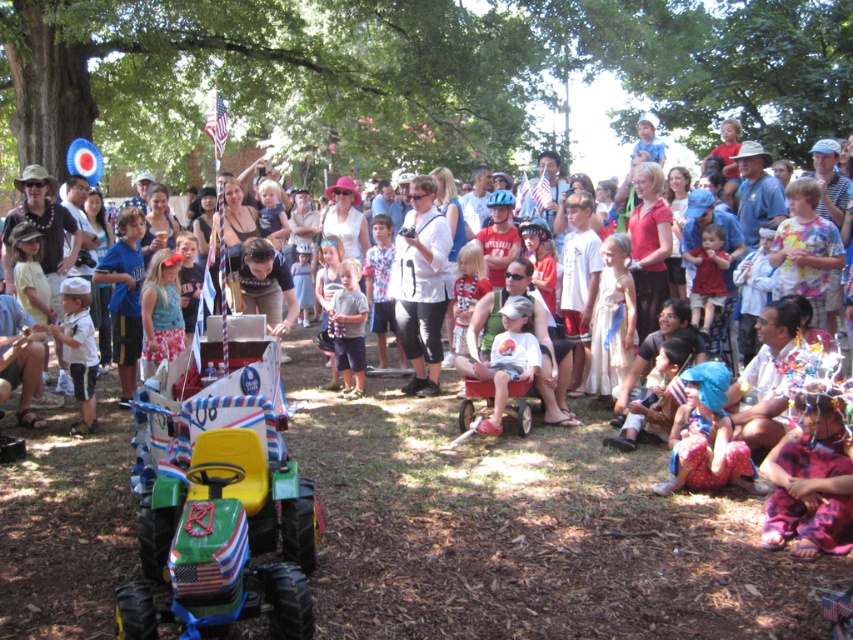
This screenshot has height=640, width=853. Identify the location of white matte shirt at left. (78, 348).

Who is more distant from viewer, [70,337] or [697,269]?

Point [697,269]

Image resolution: width=853 pixels, height=640 pixels. Identify the location of white matte shirt at left. (78, 348).

Can you confirm if blue fabric hat at lower right is positioned to the left of white matte shirt at left?

In fact, blue fabric hat at lower right is to the right of white matte shirt at left.

This screenshot has height=640, width=853. What do you see at coordinates (706, 436) in the screenshot? I see `blue fabric hat at lower right` at bounding box center [706, 436].

Is point (679, 483) positioned after point (74, 333)?

No, (679, 483) is closer to viewer.

The image size is (853, 640). I want to click on blue fabric hat at lower right, so click(706, 436).

Can you confirm if green plastic toy car at center is positioned to the left of blue fabric hat at lower right?

Yes, green plastic toy car at center is to the left of blue fabric hat at lower right.

What do you see at coordinates (219, 515) in the screenshot?
I see `green plastic toy car at center` at bounding box center [219, 515].

Who is more distant from viewer, (219, 506) or (680, 467)?

Point (680, 467)

This screenshot has height=640, width=853. I want to click on green plastic toy car at center, so click(x=219, y=515).